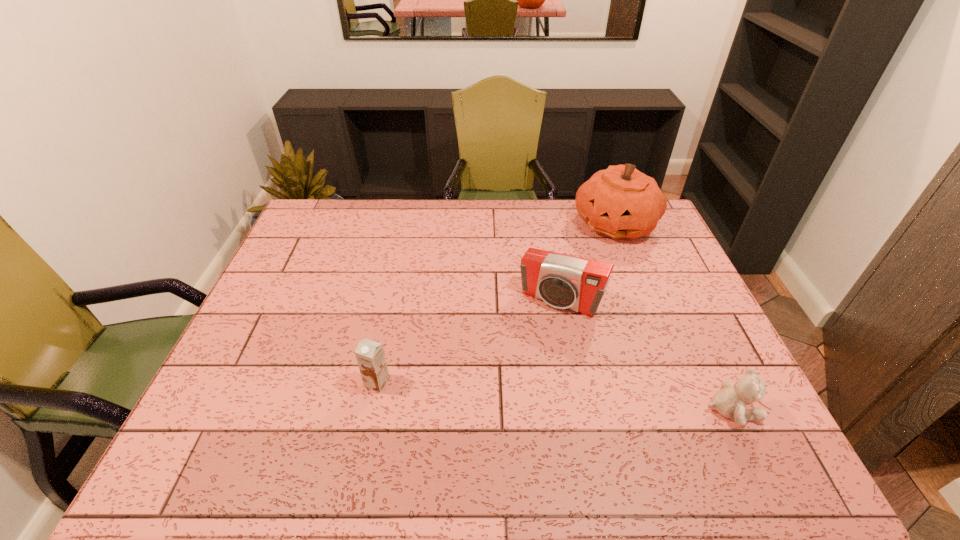
The width and height of the screenshot is (960, 540). What are the coordinates of `vacant space at the near edge of the desktop` in the screenshot? It's located at (311, 411).

Where is `vacant space at the left edge of the desktop`? The width and height of the screenshot is (960, 540). vacant space at the left edge of the desktop is located at coordinates click(x=276, y=365).

At what (x,y) coordinates should I click in order to perform the action: click on vacant space at the right edge of the desktop. Please return your answer as a coordinate pair (x, y). Looking at the image, I should click on (655, 325).

You are a GUI agent. You are given a task and a screenshot of the screen. Output one action in this format:
    pyautogui.click(x=<x>, y=<y>)
    Task: Click on the vacant space at the far left corner
    The image size is (960, 540).
    Given the screenshot: What is the action you would take?
    pyautogui.click(x=324, y=211)

Locate an element on the screen. free space at the near right corner of the desktop is located at coordinates (693, 414).

Identify the location of empty space between the leftmost object and the teddy bear. The image size is (960, 540). (554, 396).

You are a GUI agent. You are given a task and a screenshot of the screen. Output one action in this format:
    pyautogui.click(x=<x>, y=<y>)
    Task: Click on the vacant area that lies between the chocolate milk and the pumpkin
    
    Given the screenshot: What is the action you would take?
    pyautogui.click(x=495, y=303)

Where is `free space between the chocolate milk and the teddy bear`? free space between the chocolate milk and the teddy bear is located at coordinates (554, 396).

At what (x,y) coordinates should I click in order to perform the action: click on free space between the shortest object and the third nearest object. Please return your answer as a coordinate pair (x, y). Image resolution: width=960 pixels, height=540 pixels. Looking at the image, I should click on [645, 355].

The height and width of the screenshot is (540, 960). Find the location of `free space between the shortest object and the pumpkin`. free space between the shortest object and the pumpkin is located at coordinates (672, 316).